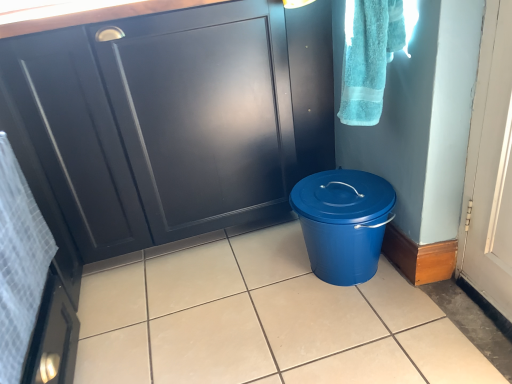
This screenshot has width=512, height=384. I want to click on vacant area that lies between white textured towel at left, which is counted as the 2th bath towel, starting from the right, and matte black cabinet at center, so click(x=188, y=300).